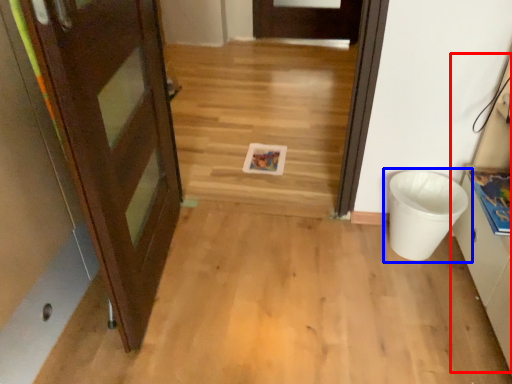
Question: Which object appears closest to the camera in this image, cabinetry (highlighted by a red box) or waste container (highlighted by a blue box)?

Choices:
 (A) cabinetry
 (B) waste container

Answer: (A)